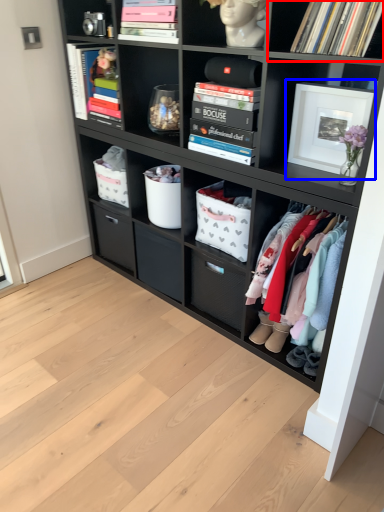
Question: Which object is closer to the camera taking this photo, shelf (highlighted by a red box) or picture frame (highlighted by a blue box)?

Choices:
 (A) shelf
 (B) picture frame

Answer: (A)